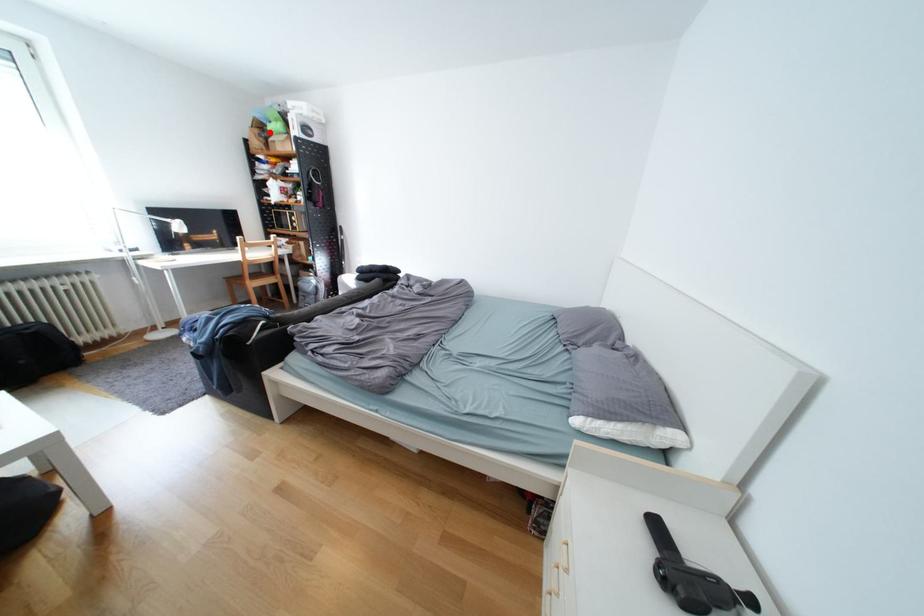
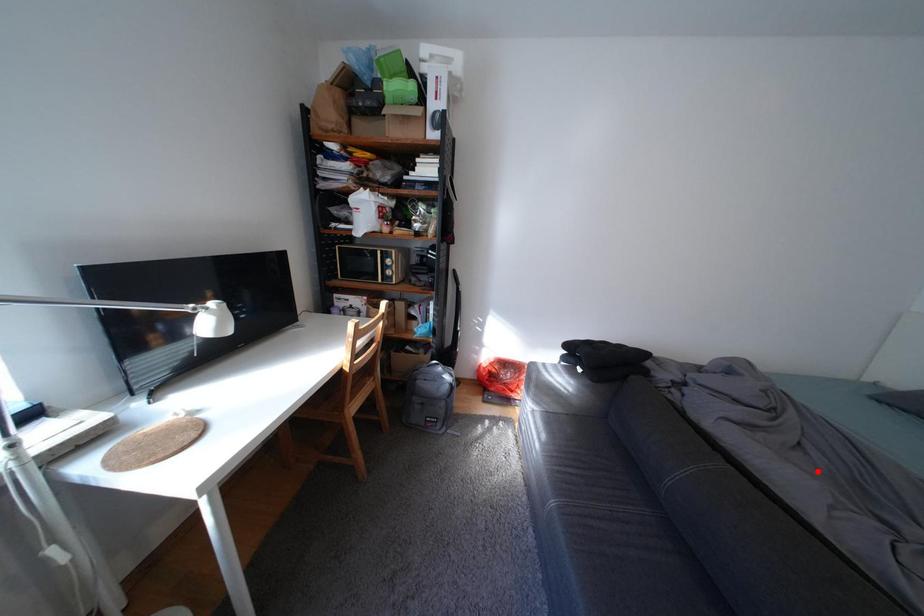
I am providing you with two images of the same scene from different viewpoints. A red point is marked on the first image and another point is marked on the second image. Does the point marked in image1 correspond to the same location as the one in image2?

No